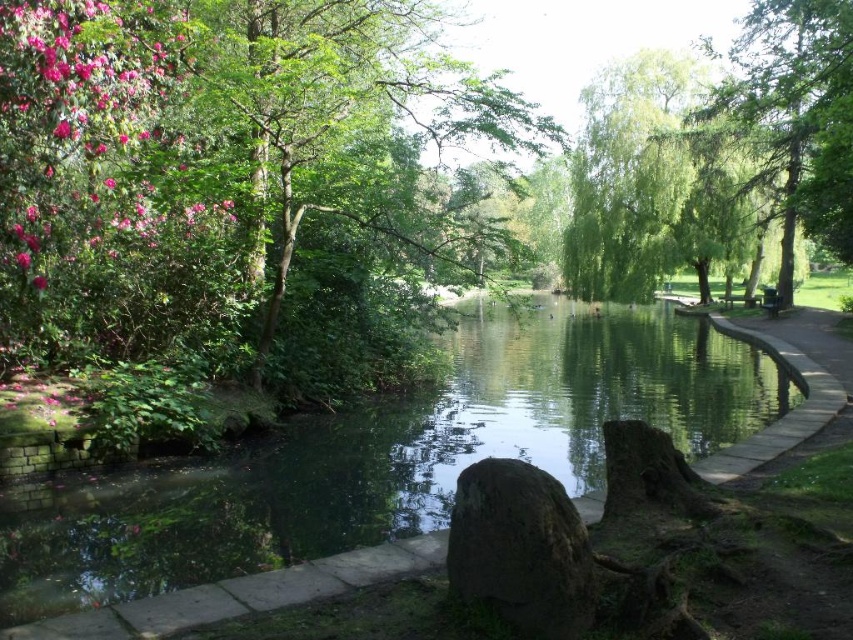
You are planning to place a small garden statue that requires a base at least 30 cm wide. The statue is meant to be placed either on the green mossy rock at center or the smooth concrete path at right. Based on the scene description, which location would be suitable for placing the statue?

The smooth concrete path at right is wider than the green mossy rock at center, so the statue should be placed on the smooth concrete path at right since it can accommodate the required width of 30 cm.

You are a park visitor standing at the edge of the green mossy rock at center. You want to reach the green smooth water at center. In which direction should you move?

The green smooth water at center is to the right of green mossy rock at center. So you should move to the right to reach the green smooth water at center.

You are planning to place a small garden sculpture exactly between the green leafy tree at upper left and the green mossy rock at center. Considering their sizes, which object will the sculpture be closer to and why?

The sculpture will be closer to the green mossy rock at center because the green leafy tree at upper left is larger in size, meaning the distance between them would require the sculpture to be nearer to the smaller object to maintain balance.